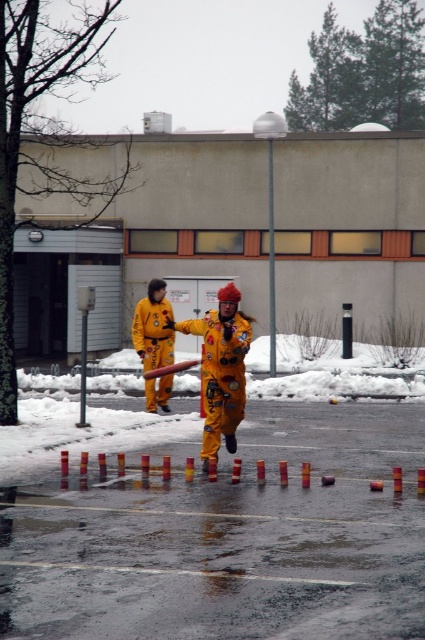
Question: Which object is farther from the camera taking this photo?

Choices:
 (A) yellow matte uniform at center
 (B) yellow fabric fireman at center

Answer: (A)

Question: Is yellow fabric fireman at center wider than yellow matte uniform at center?

Choices:
 (A) no
 (B) yes

Answer: (A)

Question: Does yellow fabric fireman at center appear on the right side of yellow matte uniform at center?

Choices:
 (A) no
 (B) yes

Answer: (B)

Question: Is yellow fabric fireman at center below yellow matte uniform at center?

Choices:
 (A) no
 (B) yes

Answer: (A)

Question: Which point is farther to the camera?

Choices:
 (A) yellow matte uniform at center
 (B) yellow fabric fireman at center

Answer: (A)